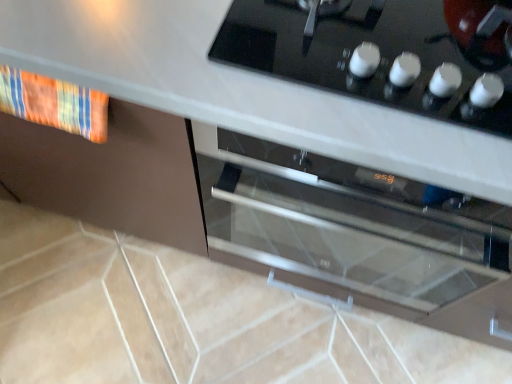
Question: From the image's perspective, is textured fabric towel at left on satin silver oven at center?

Choices:
 (A) no
 (B) yes

Answer: (B)

Question: Is textured fabric towel at left smaller than satin silver oven at center?

Choices:
 (A) yes
 (B) no

Answer: (A)

Question: Is textured fabric towel at left wider than satin silver oven at center?

Choices:
 (A) no
 (B) yes

Answer: (A)

Question: Is satin silver oven at center surrounded by textured fabric towel at left?

Choices:
 (A) yes
 (B) no

Answer: (B)

Question: Considering the relative positions of textured fabric towel at left and satin silver oven at center in the image provided, is textured fabric towel at left to the right of satin silver oven at center from the viewer's perspective?

Choices:
 (A) no
 (B) yes

Answer: (A)

Question: Considering the relative sizes of textured fabric towel at left and satin silver oven at center in the image provided, is textured fabric towel at left bigger than satin silver oven at center?

Choices:
 (A) no
 (B) yes

Answer: (A)

Question: Is the depth of black glass cooktop at upper center less than that of satin silver oven at center?

Choices:
 (A) no
 (B) yes

Answer: (B)

Question: Does black glass cooktop at upper center have a greater width compared to satin silver oven at center?

Choices:
 (A) no
 (B) yes

Answer: (A)

Question: Is black glass cooktop at upper center outside of satin silver oven at center?

Choices:
 (A) no
 (B) yes

Answer: (B)

Question: Can satin silver oven at center be found inside black glass cooktop at upper center?

Choices:
 (A) no
 (B) yes

Answer: (A)

Question: Is black glass cooktop at upper center far away from satin silver oven at center?

Choices:
 (A) no
 (B) yes

Answer: (A)

Question: Does black glass cooktop at upper center have a smaller size compared to satin silver oven at center?

Choices:
 (A) yes
 (B) no

Answer: (A)

Question: Is satin silver oven at center smaller than textured fabric towel at left?

Choices:
 (A) no
 (B) yes

Answer: (A)